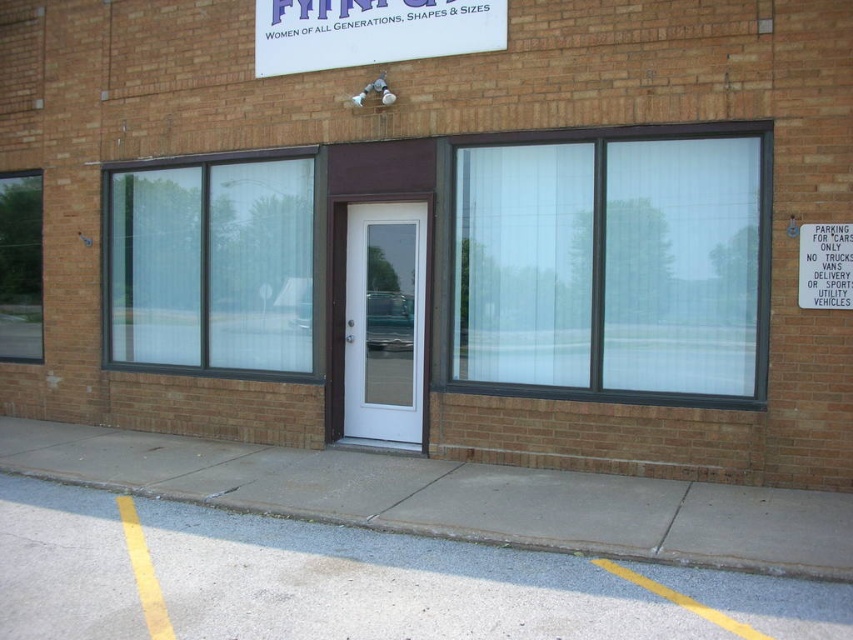
You are a delivery person trying to deliver a package to the building. You have a large cart that needs to be parked. The cart is too big to fit in the parking spot marked for cars only. Where could you park your cart instead, considering the gray concrete pavement at lower left and the white glass door at center?

The gray concrete pavement at lower left is positioned under the white glass door at center, so you can park the cart on the gray concrete pavement at lower left since it is located beneath the door and not restricted by the parking sign for cars only.

What is the relationship in size between the gray concrete sidewalk at lower center and the transparent glass door at center?

The gray concrete sidewalk at lower center is smaller than the transparent glass door at center.

What is the position of the gray concrete pavement at lower left relative to the white glass door at center?

The gray concrete pavement at lower left is located to the right of the white glass door at center.